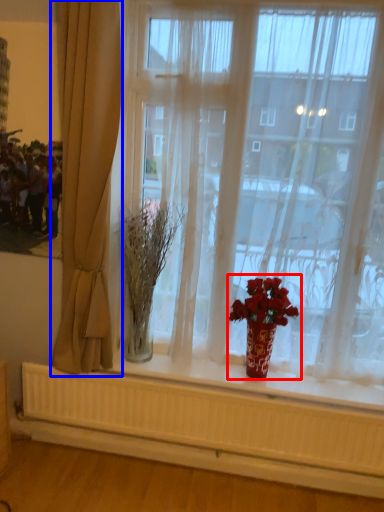
Question: Which of the following is the farthest to the observer, houseplant (highlighted by a red box) or curtain (highlighted by a blue box)?

Choices:
 (A) houseplant
 (B) curtain

Answer: (A)